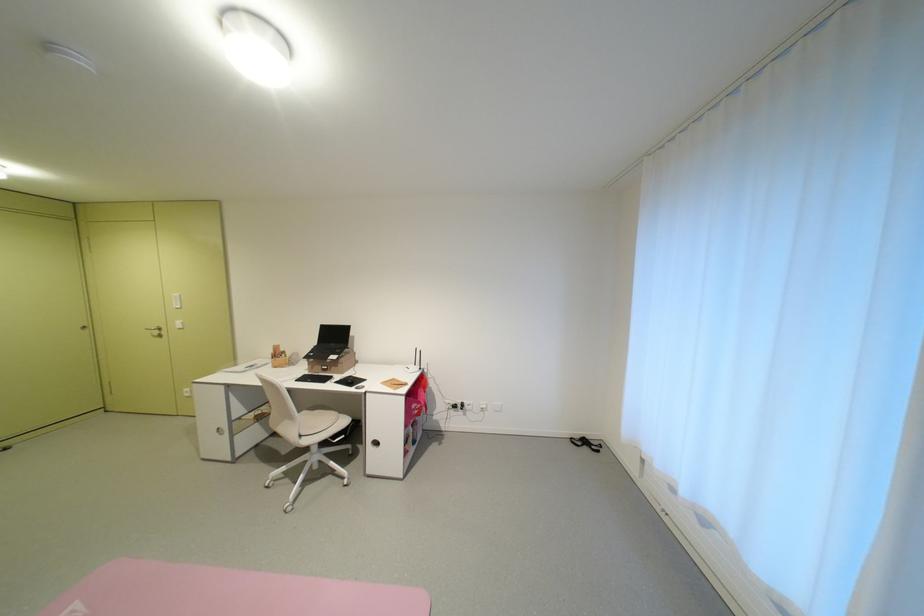
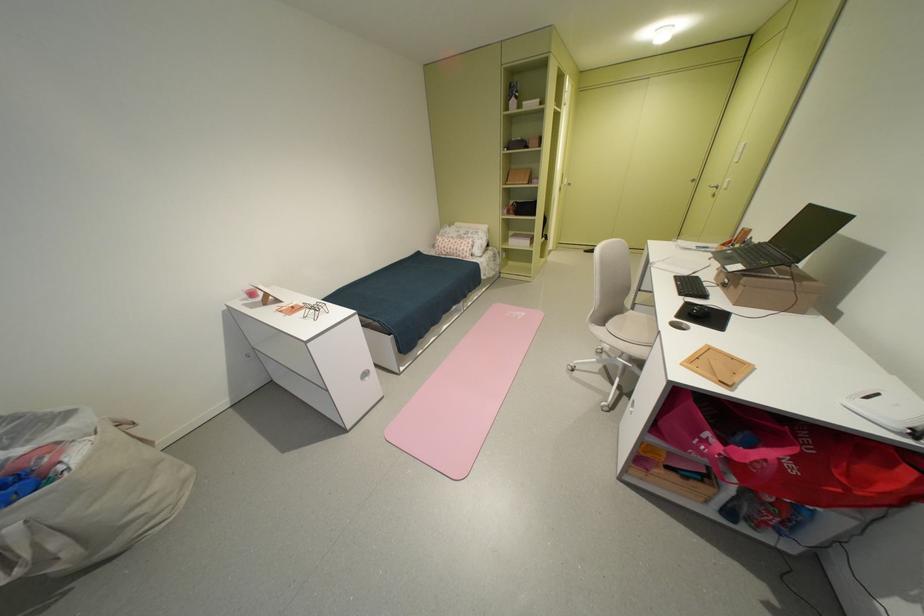
In the second image, find the point that corresponds to point (166, 331) in the first image.

(724, 190)